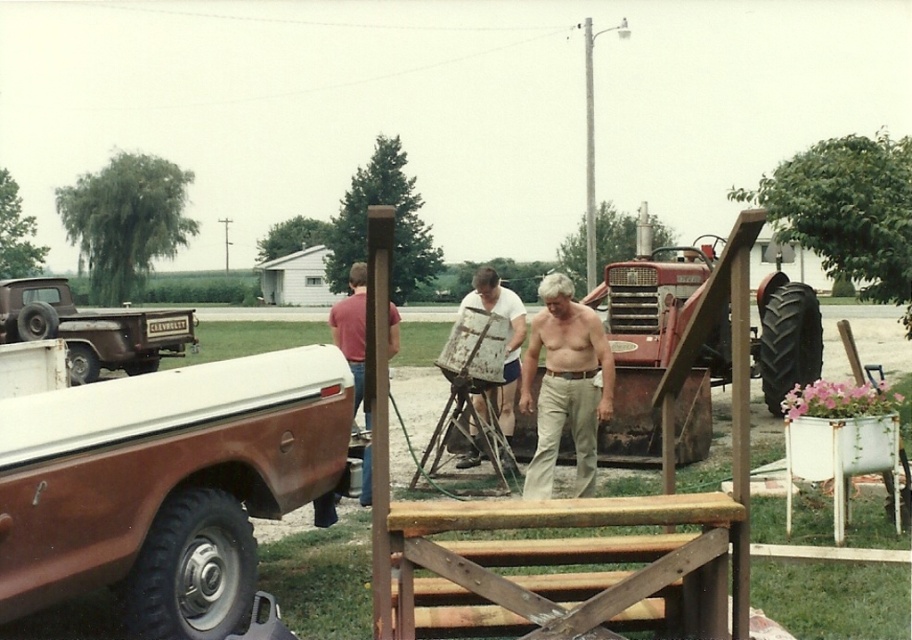
Between rusty brown truck at left and red metal tractor at center, which one is positioned lower?

rusty brown truck at left is lower down.

Does point (263, 504) come closer to viewer compared to point (693, 268)?

Yes, point (263, 504) is in front of point (693, 268).

The height and width of the screenshot is (640, 912). Identify the location of rusty brown truck at left. (164, 484).

Can you confirm if rusty brown truck at left is smaller than matte red shirt at center?

Yes.

What do you see at coordinates (164, 484) in the screenshot? Image resolution: width=912 pixels, height=640 pixels. I see `rusty brown truck at left` at bounding box center [164, 484].

At what (x,y) coordinates should I click in order to perform the action: click on rusty brown truck at left. Please return your answer as a coordinate pair (x, y). This screenshot has height=640, width=912. Looking at the image, I should click on (164, 484).

Between rusty brown truck at left and beige cotton pants at center, which one is positioned lower?

rusty brown truck at left is lower down.

Can you confirm if rusty brown truck at left is thinner than beige cotton pants at center?

Incorrect, rusty brown truck at left's width is not less than beige cotton pants at center's.

The width and height of the screenshot is (912, 640). I want to click on rusty brown truck at left, so click(x=164, y=484).